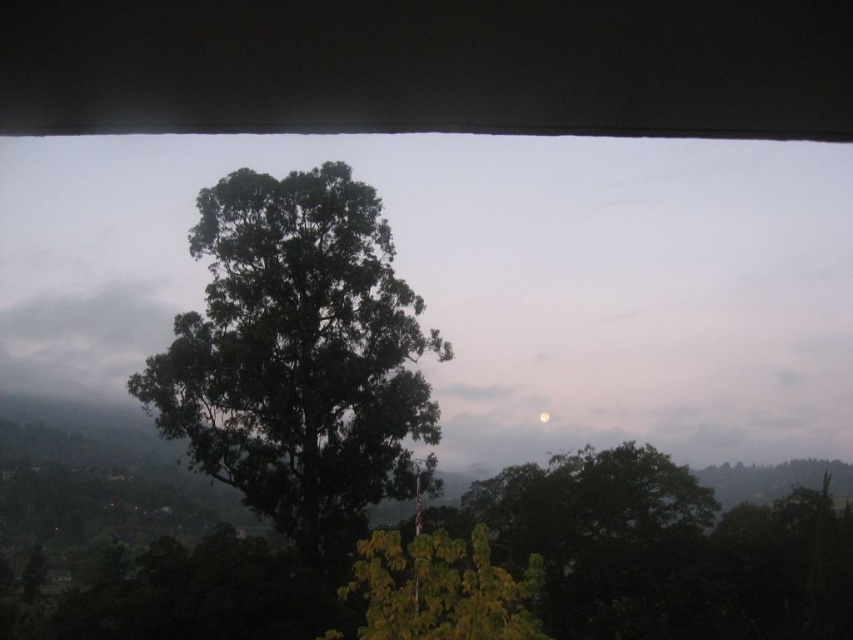
Question: Does green leafy tree at center appear over bright silver moon at center?

Choices:
 (A) no
 (B) yes

Answer: (B)

Question: Does green leafy tree at center appear under gray fluffy cloud at upper left?

Choices:
 (A) no
 (B) yes

Answer: (B)

Question: Does green leafy tree at center lie in front of gray fluffy cloud at upper left?

Choices:
 (A) yes
 (B) no

Answer: (A)

Question: Which object is the closest to the green leafy tree at center?

Choices:
 (A) gray fluffy cloud at upper left
 (B) bright silver moon at center

Answer: (A)

Question: Which object is farther from the camera taking this photo?

Choices:
 (A) green leafy tree at center
 (B) bright silver moon at center
 (C) gray fluffy cloud at upper left

Answer: (B)

Question: Which point appears closest to the camera in this image?

Choices:
 (A) (547, 420)
 (B) (390, 531)
 (C) (76, 296)
 (D) (292, 193)

Answer: (B)